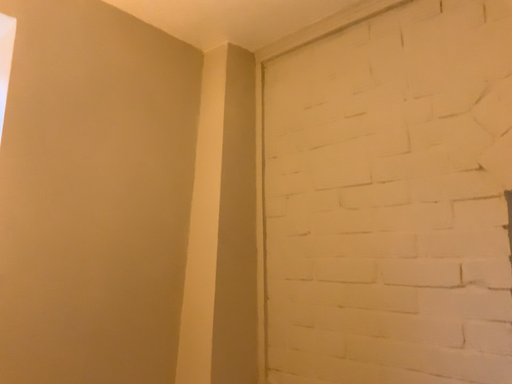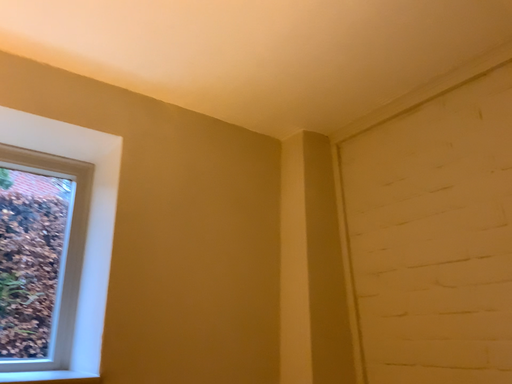
Question: How did the camera likely rotate when shooting the video?

Choices:
 (A) rotated downward
 (B) rotated upward

Answer: (B)